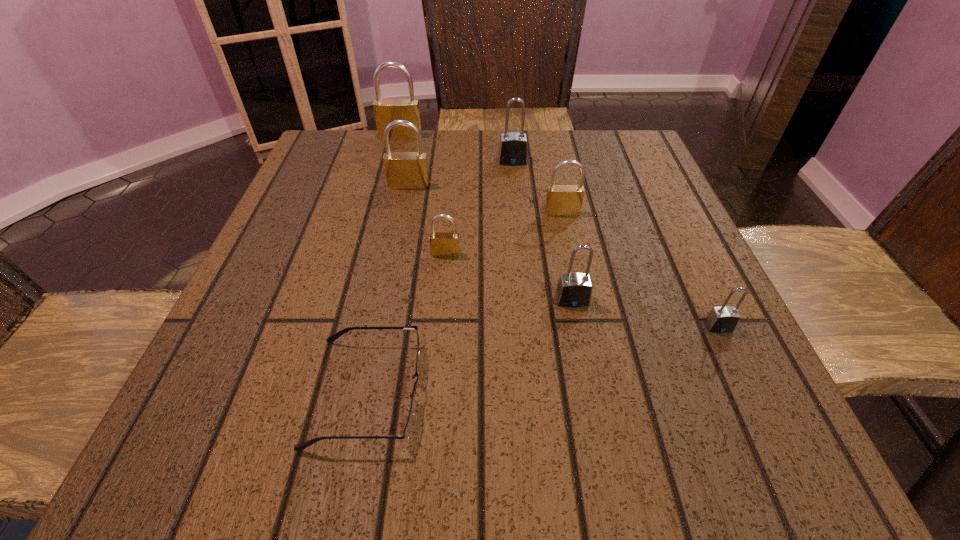
You are a GUI agent. You are given a task and a screenshot of the screen. Output one action in this format:
    pyautogui.click(x=<x>, y=<y>)
    Task: Click on the free space located 0.080m on the front-facing side of the fifth nearest object
    
    Given the screenshot: What is the action you would take?
    pyautogui.click(x=568, y=243)

Where is `free space located 0.180m on the shackle of the rightmost object`? free space located 0.180m on the shackle of the rightmost object is located at coordinates (776, 449).

Locate an element on the screen. free location located on the front-facing side of the third nearest padlock is located at coordinates (436, 386).

You are a GUI agent. You are given a task and a screenshot of the screen. Output one action in this format:
    pyautogui.click(x=<x>, y=<y>)
    Task: Click on the vacant area situated 0.260m on the front-facing side of the shortest object
    This screenshot has width=960, height=540.
    Given the screenshot: What is the action you would take?
    pyautogui.click(x=610, y=392)

Find the location of a particular element. Image resolution: width=960 pixels, height=540 pixels. object that is at the near edge is located at coordinates (408, 428).

The image size is (960, 540). Find the location of `object that is at the left edge`. object that is at the left edge is located at coordinates (386, 111).

Find the location of a particular element. object that is at the right edge is located at coordinates (723, 319).

The image size is (960, 540). Identify the location of object that is positioned at the far left corner. (386, 111).

In the image, there is a desktop. At what (x,y) coordinates should I click in order to perform the action: click on vacant space at the far edge. Please return your answer as a coordinate pair (x, y). Looking at the image, I should click on (499, 182).

In the image, there is a desktop. Identify the location of vacant space at the near edge. This screenshot has height=540, width=960. (531, 430).